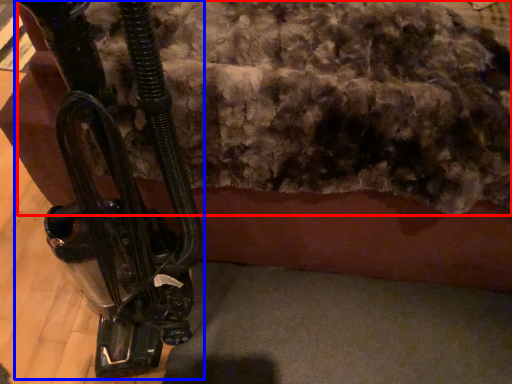
Question: Among these objects, which one is nearest to the camera, wool (highlighted by a red box) or vehicle (highlighted by a blue box)?

Choices:
 (A) wool
 (B) vehicle

Answer: (B)